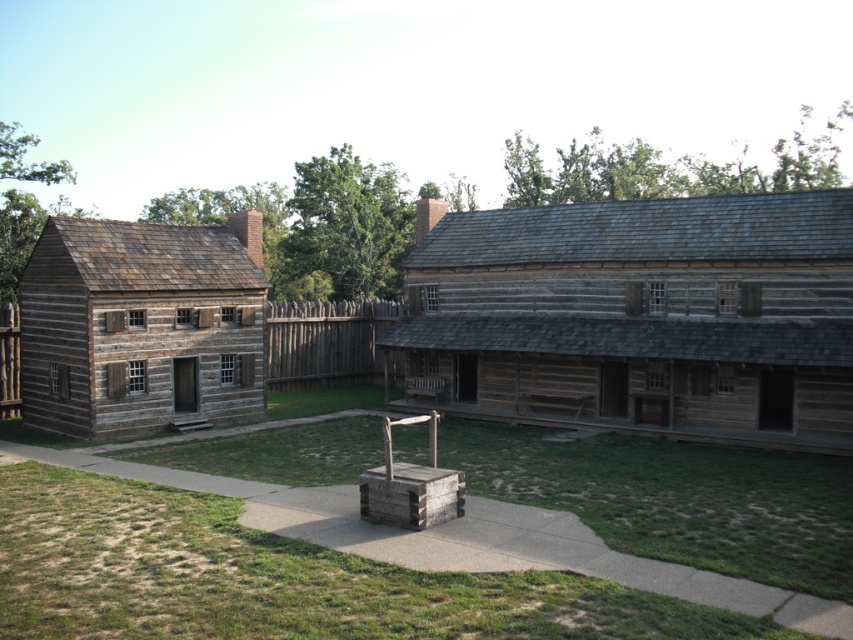
Question: Is weathered brown wood log cabin at center in front of light brown wooden log cabin at left?

Choices:
 (A) no
 (B) yes

Answer: (B)

Question: Is wooden well at center above light brown wooden log cabin at left?

Choices:
 (A) yes
 (B) no

Answer: (B)

Question: Which object is farther from the camera taking this photo?

Choices:
 (A) light brown wooden log cabin at left
 (B) weathered brown wood log cabin at center
 (C) wooden well at center

Answer: (A)

Question: Estimate the real-world distances between objects in this image. Which object is closer to the wooden well at center?

Choices:
 (A) weathered brown wood log cabin at center
 (B) light brown wooden log cabin at left

Answer: (A)

Question: Does wooden well at center appear on the left side of weathered brown wood log cabin at center?

Choices:
 (A) yes
 (B) no

Answer: (A)

Question: Which of the following is the closest to the observer?

Choices:
 (A) weathered brown wood log cabin at center
 (B) wooden well at center
 (C) light brown wooden log cabin at left

Answer: (B)